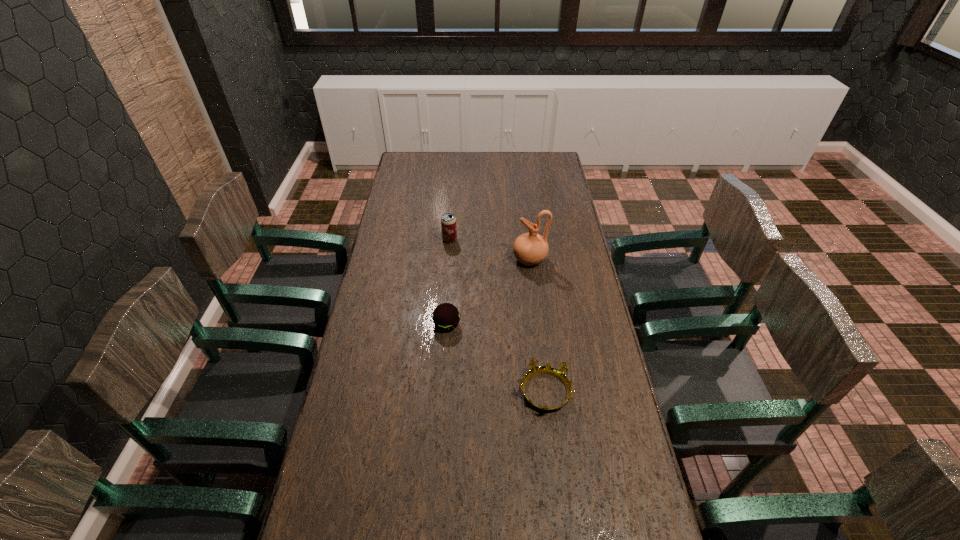
Identify the location of vacant space in between the tallest object and the nearest object. Image resolution: width=960 pixels, height=540 pixels. (538, 326).

Where is `object that is the third closest to the farthest object`? The image size is (960, 540). object that is the third closest to the farthest object is located at coordinates (560, 373).

Point out which object is positioned as the nearest to the nearest object. Please provide its 2D coordinates. Your answer should be formatted as a tuple, i.e. [(x, y)], where the tuple contains the x and y coordinates of a point satisfying the conditions above.

[(446, 317)]

Image resolution: width=960 pixels, height=540 pixels. I want to click on free region that satisfies the following two spatial constraints: 1. on the spout of the pottery; 2. on the front side of the crown, so click(x=545, y=392).

This screenshot has height=540, width=960. I want to click on vacant area that satisfies the following two spatial constraints: 1. on the spout of the third nearest object; 2. on the front side of the crown, so click(545, 392).